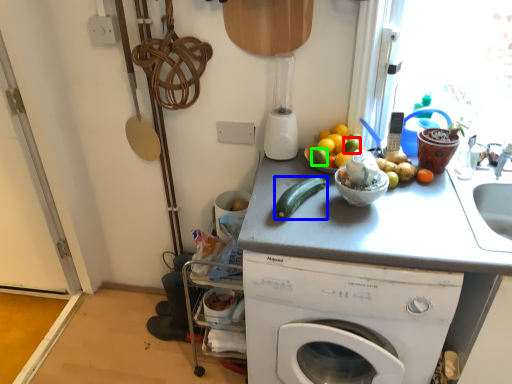
Question: Considering the real-world distances, which object is farthest from lime (highlighted by a red box)? green vegetables (highlighted by a blue box) or lime (highlighted by a green box)?

Choices:
 (A) green vegetables
 (B) lime

Answer: (A)